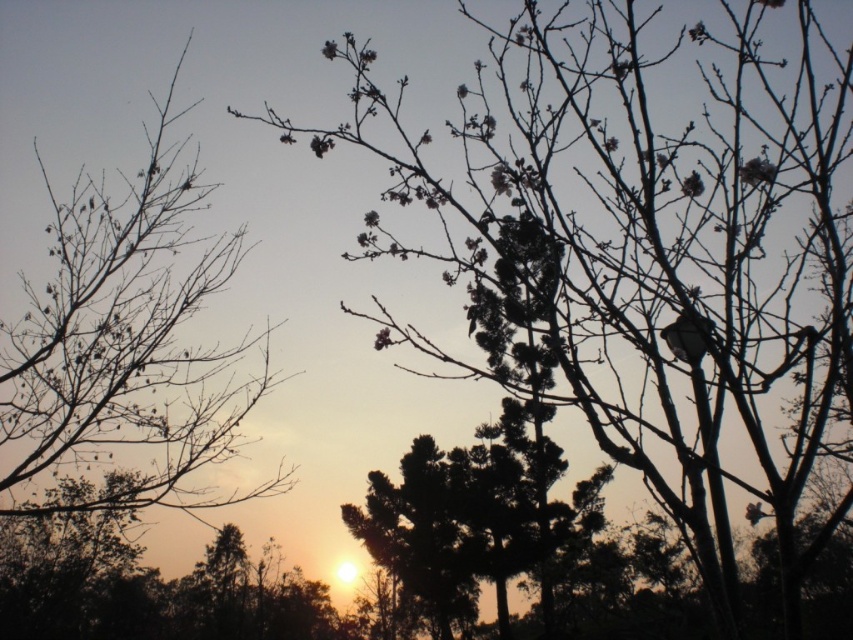
Is silvery branches at center taller than silhouette bark tree at left?

Correct, silvery branches at center is much taller as silhouette bark tree at left.

How far apart are silvery branches at center and silhouette bark tree at left?

silvery branches at center and silhouette bark tree at left are 13.88 feet apart from each other.

Which is behind, point (508, 356) or point (39, 316)?

Point (508, 356)

This screenshot has width=853, height=640. I want to click on silvery branches at center, so click(x=643, y=259).